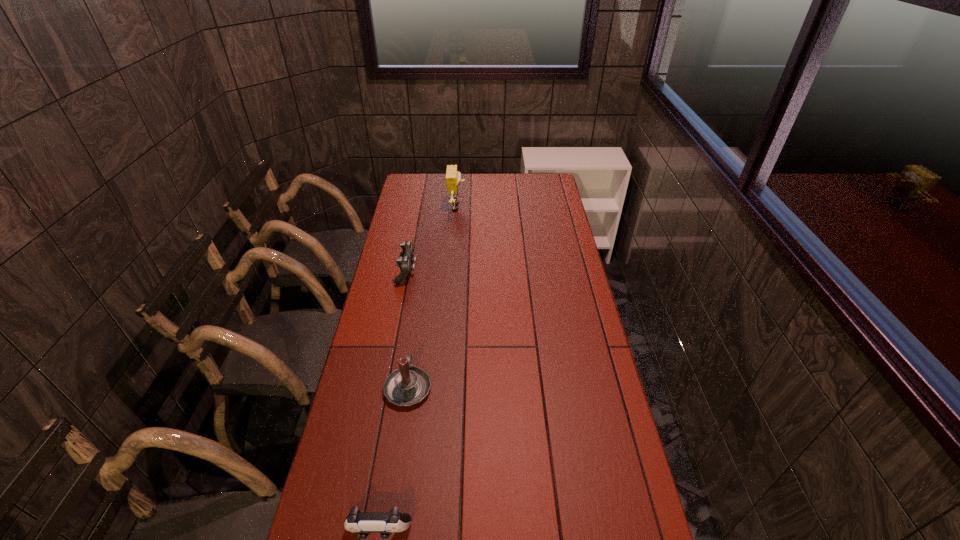
Locate an element on the screen. object that is at the far edge is located at coordinates (453, 177).

Image resolution: width=960 pixels, height=540 pixels. I want to click on candle located at the left edge, so click(409, 385).

Identify the location of control at the left edge. (405, 261).

What are the coordinates of `vacant space at the far edge of the desktop` in the screenshot? It's located at (514, 192).

You are a GUI agent. You are given a task and a screenshot of the screen. Output one action in this format:
    pyautogui.click(x=<x>, y=<y>)
    Task: Click on the vacant space at the left edge of the desktop
    This screenshot has height=540, width=960.
    Given the screenshot: What is the action you would take?
    pyautogui.click(x=393, y=231)

This screenshot has width=960, height=540. I want to click on vacant space at the right edge of the desktop, so click(544, 266).

In the image, there is a desktop. Where is `blank space at the far left corner`? The width and height of the screenshot is (960, 540). blank space at the far left corner is located at coordinates (427, 183).

This screenshot has width=960, height=540. I want to click on vacant space at the far right corner of the desktop, so click(x=550, y=178).

This screenshot has height=540, width=960. In order to click on blank region between the farthest object and the third farthest object in this screenshot , I will do `click(433, 297)`.

The height and width of the screenshot is (540, 960). I want to click on free space between the farthest object and the second nearest object, so click(x=433, y=297).